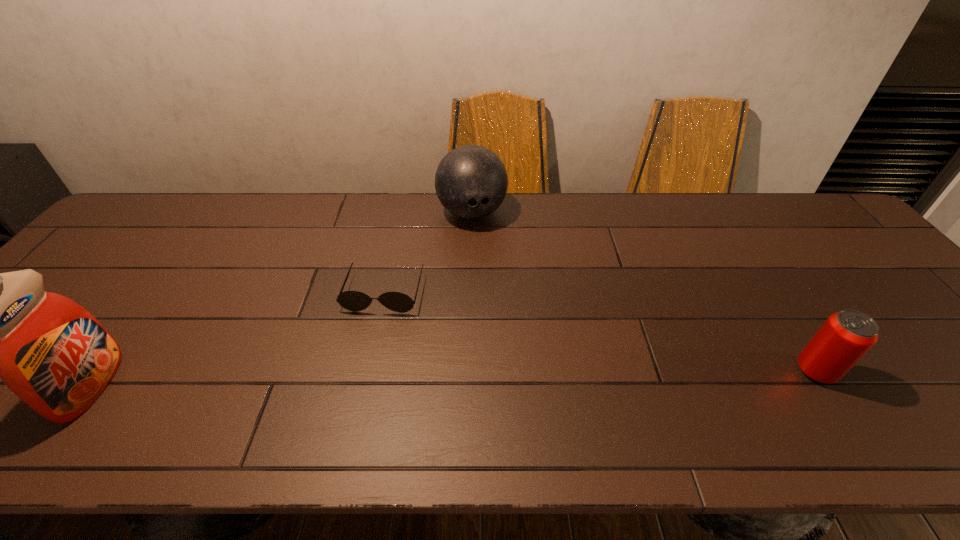
At what (x,y) coordinates should I click in order to perform the action: click on vacant space on the desktop that is between the tallest object and the can and is positioned on the front-facing side of the sunglasses. Please return your answer as a coordinate pair (x, y). The image size is (960, 540). Looking at the image, I should click on (357, 380).

I want to click on free space on the desktop that is between the tallest object and the can and is positioned on the grip area of the farthest object, so click(531, 376).